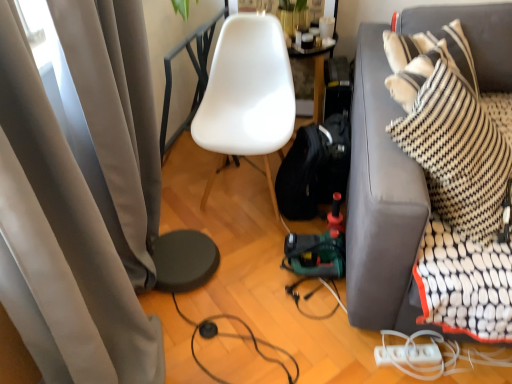
Question: Considering the relative positions of black rubber cable at lower center, the second cable viewed from the right, and white plastic extension cord at lower right in the image provided, is black rubber cable at lower center, the second cable viewed from the right, in front of white plastic extension cord at lower right?

Choices:
 (A) no
 (B) yes

Answer: (B)

Question: From the image's perspective, is black rubber cable at lower center, the second cable viewed from the right, above white plastic extension cord at lower right?

Choices:
 (A) yes
 (B) no

Answer: (A)

Question: Can we say black rubber cable at lower center, the second cable viewed from the right, lies outside white plastic extension cord at lower right?

Choices:
 (A) yes
 (B) no

Answer: (A)

Question: Does black rubber cable at lower center, the second cable viewed from the right, come behind white plastic extension cord at lower right?

Choices:
 (A) yes
 (B) no

Answer: (B)

Question: Is black rubber cable at lower center, the second cable viewed from the right, not close to white plastic extension cord at lower right?

Choices:
 (A) yes
 (B) no

Answer: (B)

Question: From a real-world perspective, is black rubber cable at lower center, marked as the 1th cable in a left-to-right arrangement, positioned under white plastic extension cord at lower right based on gravity?

Choices:
 (A) yes
 (B) no

Answer: (A)

Question: From a real-world perspective, is white matte chair at center below matte gray curtain at left?

Choices:
 (A) no
 (B) yes

Answer: (B)

Question: Is white matte chair at center further to camera compared to matte gray curtain at left?

Choices:
 (A) no
 (B) yes

Answer: (B)

Question: Is white matte chair at center bigger than matte gray curtain at left?

Choices:
 (A) no
 (B) yes

Answer: (A)

Question: From a real-world perspective, is white matte chair at center physically above matte gray curtain at left?

Choices:
 (A) no
 (B) yes

Answer: (A)

Question: Does white matte chair at center appear on the right side of matte gray curtain at left?

Choices:
 (A) yes
 (B) no

Answer: (A)

Question: Does white matte chair at center have a lesser height compared to matte gray curtain at left?

Choices:
 (A) yes
 (B) no

Answer: (A)

Question: Considering the relative positions of white plastic power strip at lower right, which is counted as the 1th cable, starting from the right, and dark gray fabric couch at right in the image provided, is white plastic power strip at lower right, which is counted as the 1th cable, starting from the right, to the right of dark gray fabric couch at right from the viewer's perspective?

Choices:
 (A) yes
 (B) no

Answer: (B)